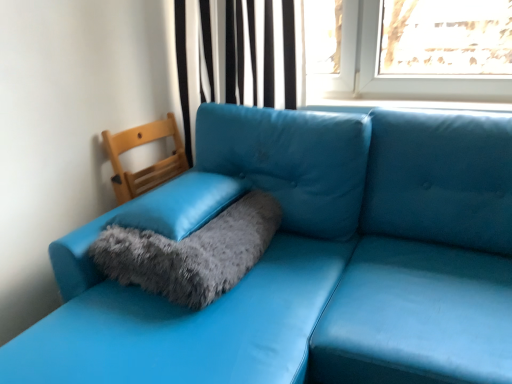
Question: From the image's perspective, is black striped curtain at upper center located above or below matte blue leather couch at lower left?

Choices:
 (A) above
 (B) below

Answer: (A)

Question: Considering the positions of point (221, 3) and point (488, 349), is point (221, 3) closer or farther from the camera than point (488, 349)?

Choices:
 (A) farther
 (B) closer

Answer: (A)

Question: Which is farther from the fuzzy gray cat bed at center?

Choices:
 (A) matte blue leather couch at lower left
 (B) fuzzy gray pillow at center
 (C) black striped curtain at upper center
 (D) wooden chair at left

Answer: (C)

Question: Estimate the real-world distances between objects in this image. Which object is farther from the black striped curtain at upper center?

Choices:
 (A) fuzzy gray pillow at center
 (B) wooden chair at left
 (C) matte blue leather couch at lower left
 (D) fuzzy gray cat bed at center

Answer: (D)